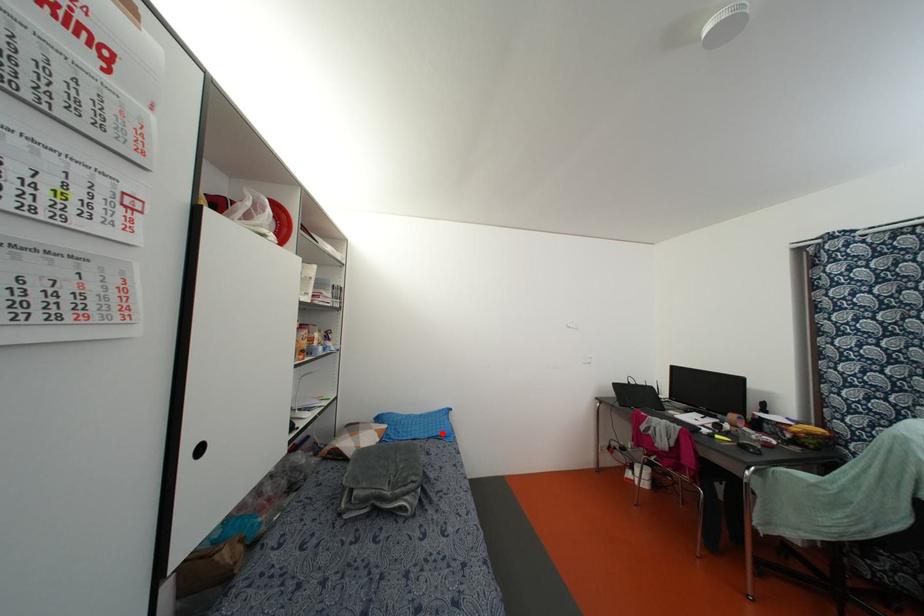
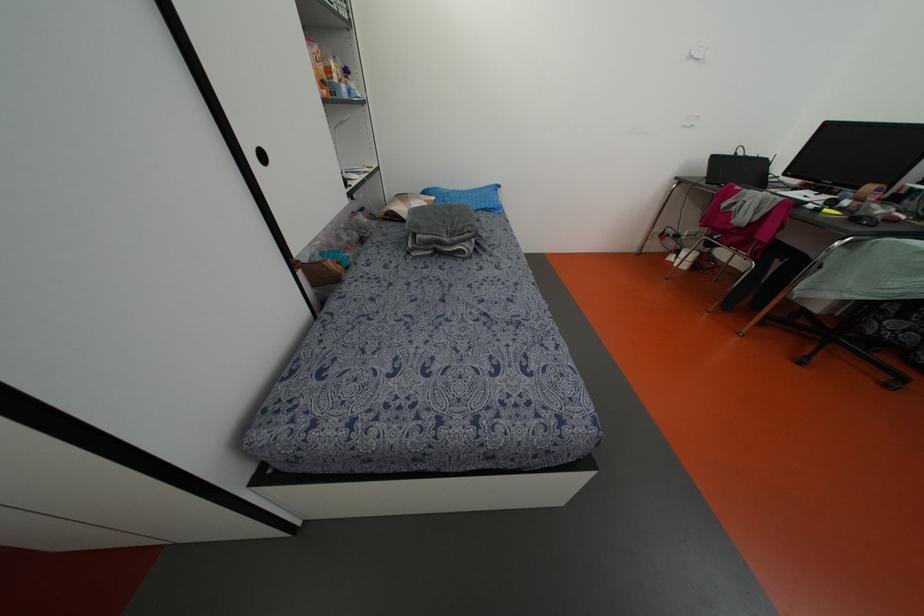
Locate, in the second image, the point that corresponds to the highlighted location in the first image.

(492, 206)